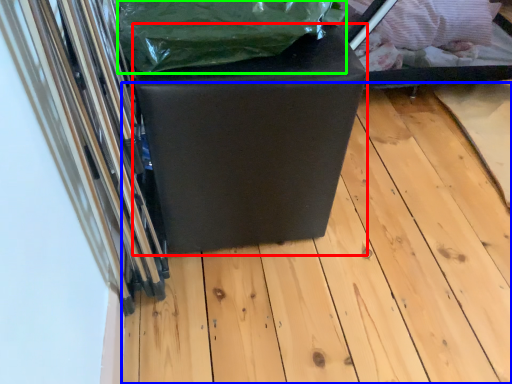
Question: Estimate the real-world distances between objects in this image. Which object is farther from furniture (highlighted by a red box), wood (highlighted by a blue box) or waste (highlighted by a green box)?

Choices:
 (A) wood
 (B) waste

Answer: (A)